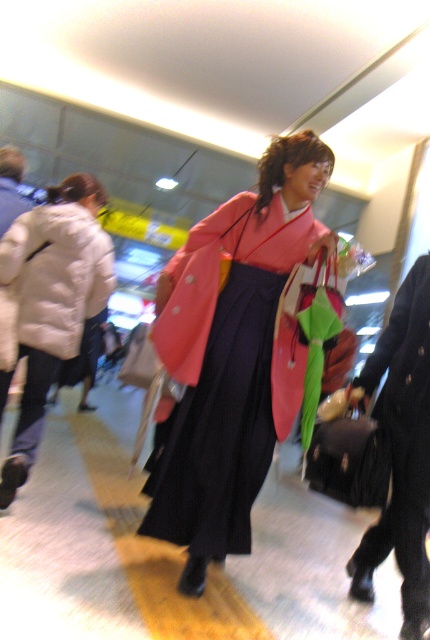
Does pink satin kimono at center appear under white puffy coat at left?

Yes.

From the picture: Who is positioned more to the left, pink satin kimono at center or white puffy coat at left?

white puffy coat at left

Which is in front, point (273, 451) or point (63, 305)?

Point (273, 451) is more forward.

Where is `pink satin kimono at center`? This screenshot has height=640, width=430. pink satin kimono at center is located at coordinates (230, 355).

Can you confirm if white matte jacket at left is positioned to the right of velvet black robe at lower right?

In fact, white matte jacket at left is to the left of velvet black robe at lower right.

Does white matte jacket at left appear on the left side of velvet black robe at lower right?

Correct, you'll find white matte jacket at left to the left of velvet black robe at lower right.

Is point (30, 342) less distant than point (411, 448)?

No.

This screenshot has width=430, height=640. I want to click on white matte jacket at left, so click(x=52, y=300).

Between point (89, 234) and point (18, 241), which one is positioned behind?

The point (89, 234) is behind.

You are a GUI agent. You are given a task and a screenshot of the screen. Output one action in this format:
    pyautogui.click(x=<x>, y=<y>)
    Task: Click on the white matte jacket at left
    This screenshot has width=430, height=640.
    Given the screenshot: What is the action you would take?
    pyautogui.click(x=52, y=300)

Locate an element on the screen. The width and height of the screenshot is (430, 640). white matte jacket at left is located at coordinates (52, 300).